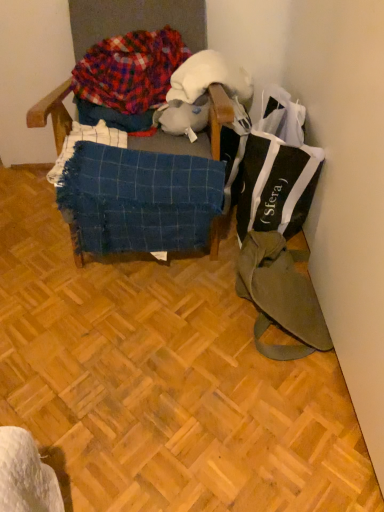
Question: Is blue woven blanket at center wider or thinner than white plush toy at center?

Choices:
 (A) wide
 (B) thin

Answer: (B)

Question: Visually, is blue woven blanket at center positioned to the left or to the right of white plush toy at center?

Choices:
 (A) right
 (B) left

Answer: (B)

Question: Estimate the real-world distances between objects in this image. Which object is farther from the white wool at upper center?

Choices:
 (A) black fabric bag at upper right
 (B) olive green canvas messenger bag at lower right
 (C) blue woven blanket at center
 (D) wooden chair at center
 (E) wooden parquet floor at center

Answer: (E)

Question: Considering the real-world distances, which object is closest to the black fabric bag at upper right?

Choices:
 (A) wooden parquet floor at center
 (B) blue woven blanket at center
 (C) wooden chair at center
 (D) olive green canvas messenger bag at lower right
 (E) white wool at upper center

Answer: (D)